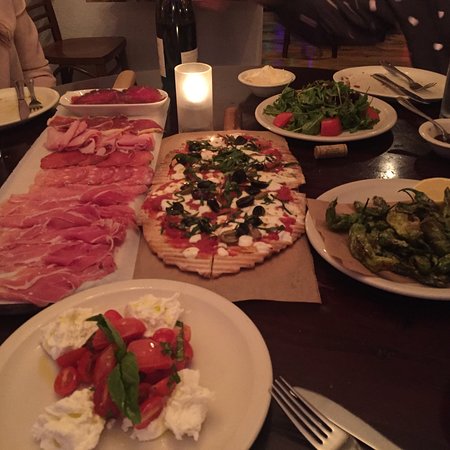
Locate an element on the screen. This screenshot has width=450, height=450. food dishes is located at coordinates (60, 174), (333, 110), (406, 231), (242, 205), (145, 374).